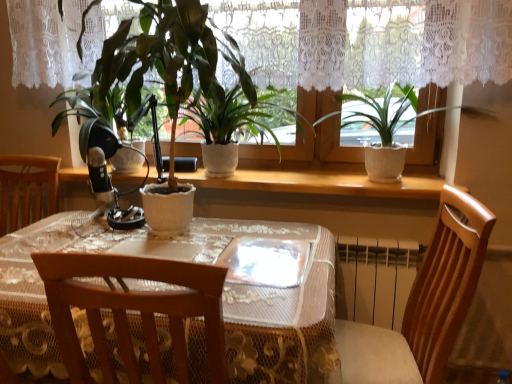
Locate an element on the screen. The image size is (512, 384). vacant space behind transparent plastic plate at center is located at coordinates (256, 232).